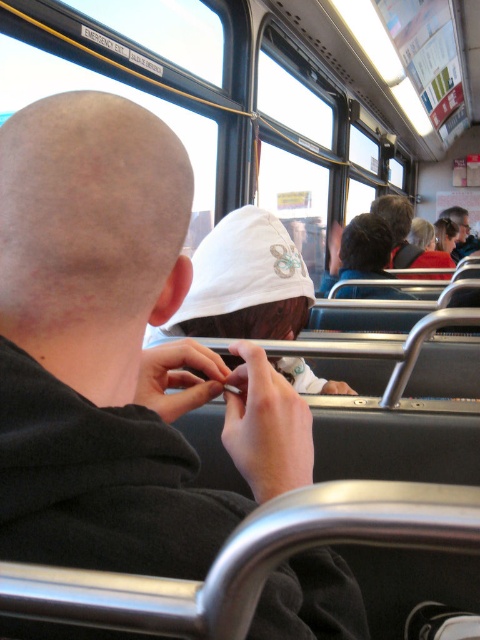
You are standing at the back of the bus and want to move towards the front. There are two points marked on the bus floor, point (368,243) and point (466,225). Which point is closer to you as you face forward?

Point (368,243) is closer to the viewer than point (466,225), so the point closer to you as you face forward is point (368,243).

You are a passenger on a bus and want to know the distance between the bald scalp at center and the nearest handrail. Can you determine if it is less than 50 centimeters?

The bald scalp at center and the nearest handrail are 40.36 centimeters apart, so the distance is less than 50 centimeters.

You are a passenger on a bus and you notice two people sitting in front of you. One has a bald scalp at center and the other has silvery metallic hair at center. Which person has a smaller area of visible hair?

The bald scalp at center is smaller than silvery metallic hair at center, so the person with the bald scalp at center has a smaller area of visible hair.